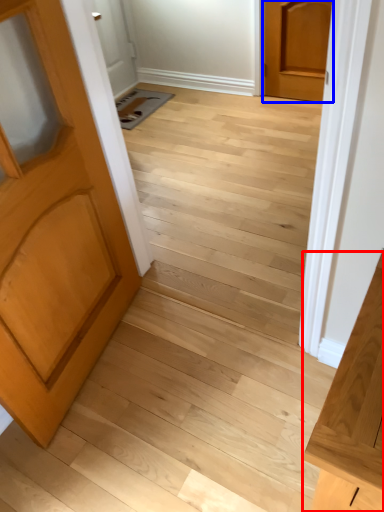
Question: Which object is closer to the camera taking this photo, vanity (highlighted by a red box) or door (highlighted by a blue box)?

Choices:
 (A) vanity
 (B) door

Answer: (A)